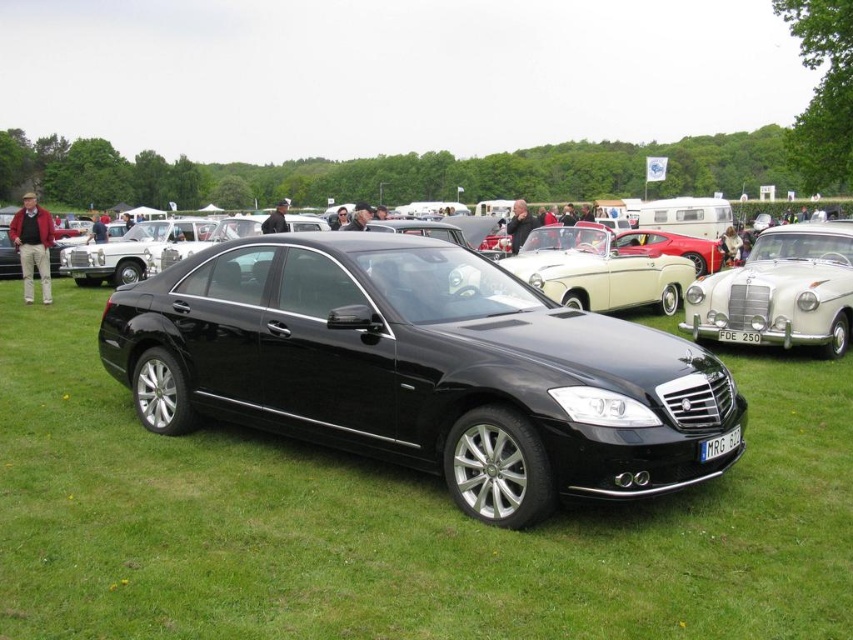
Is black metallic sedan at center above black plastic license plate at center?

Yes.

Is point (561, 291) behind point (728, 445)?

Yes, point (561, 291) is behind point (728, 445).

Locate an element on the screen. black metallic sedan at center is located at coordinates (599, 269).

At what (x,y) coordinates should I click in order to perform the action: click on black metallic sedan at center. Please return your answer as a coordinate pair (x, y). Looking at the image, I should click on (599, 269).

Does black metallic sedan at center have a larger size compared to white plastic license plate at center?

Indeed, black metallic sedan at center has a larger size compared to white plastic license plate at center.

Which of these two, black metallic sedan at center or white plastic license plate at center, stands shorter?

With less height is white plastic license plate at center.

Is point (637, 285) in front of point (747, 342)?

That is False.

Find the location of `black metallic sedan at center`. black metallic sedan at center is located at coordinates (599, 269).

Can you confirm if black plastic license plate at center is bigger than white plastic license plate at center?

Actually, black plastic license plate at center might be smaller than white plastic license plate at center.

Which is in front, point (706, 451) or point (734, 336)?

Point (706, 451)

What do you see at coordinates (720, 444) in the screenshot?
I see `black plastic license plate at center` at bounding box center [720, 444].

The image size is (853, 640). In order to click on black plastic license plate at center in this screenshot , I will do `click(720, 444)`.